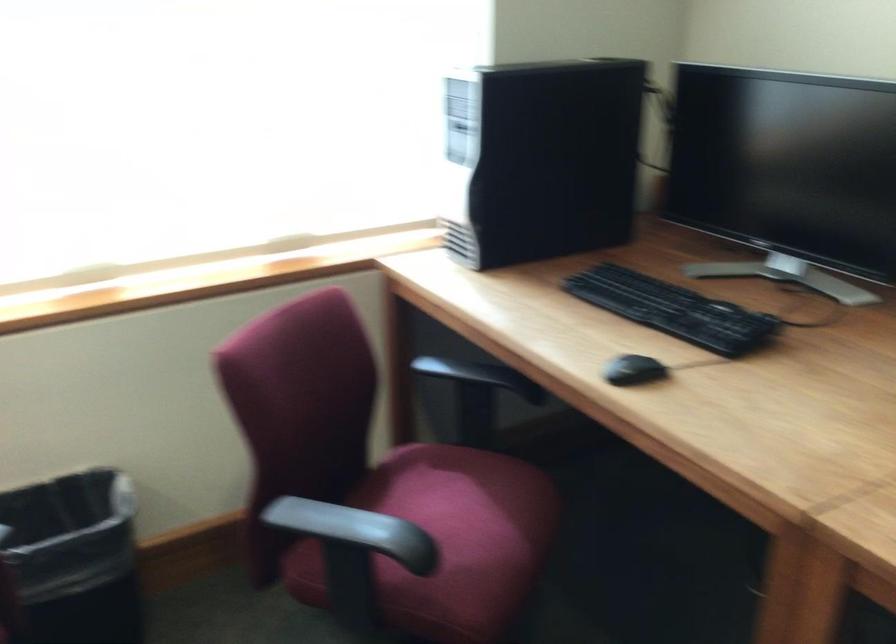
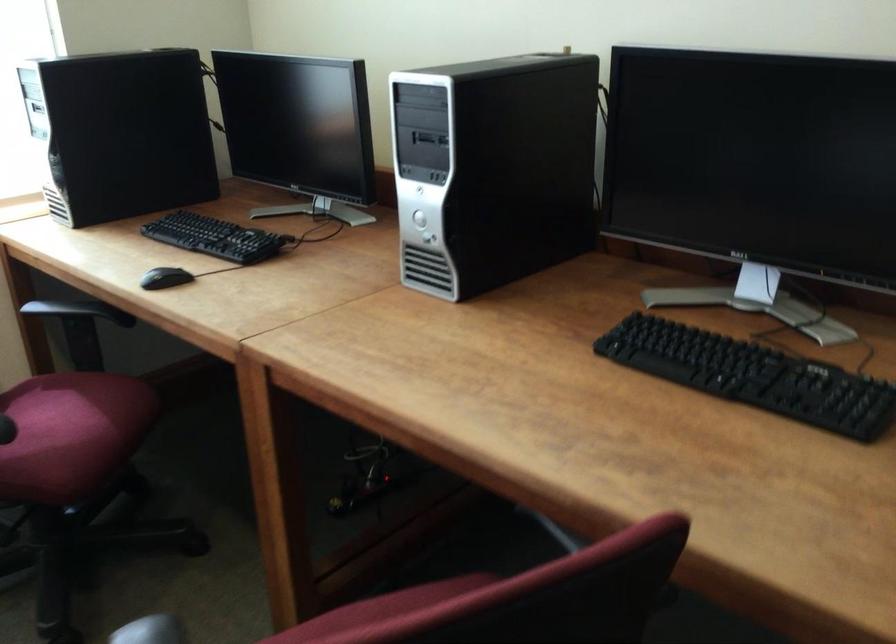
The point at (479, 377) is marked in the first image. Where is the corresponding point in the second image?

(74, 310)